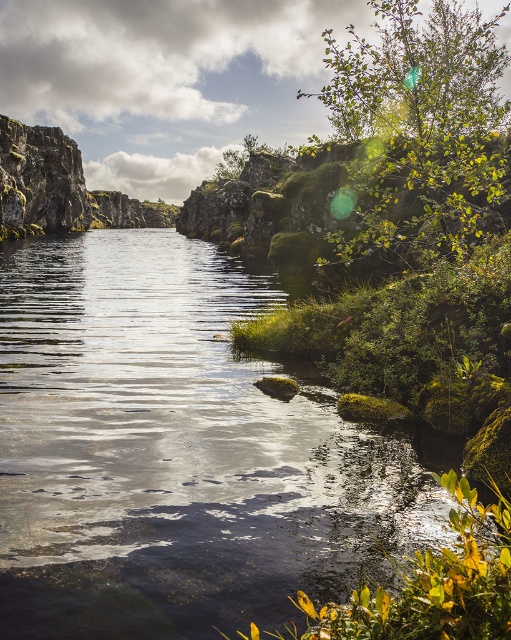
You are a hiker standing at the edge of the clear water at center and want to reach the green leafy plant at lower right. Which direction should you move to get there?

The clear water at center is positioned over the green leafy plant at lower right, so you should move downward to reach the green leafy plant at lower right from the clear water at center.